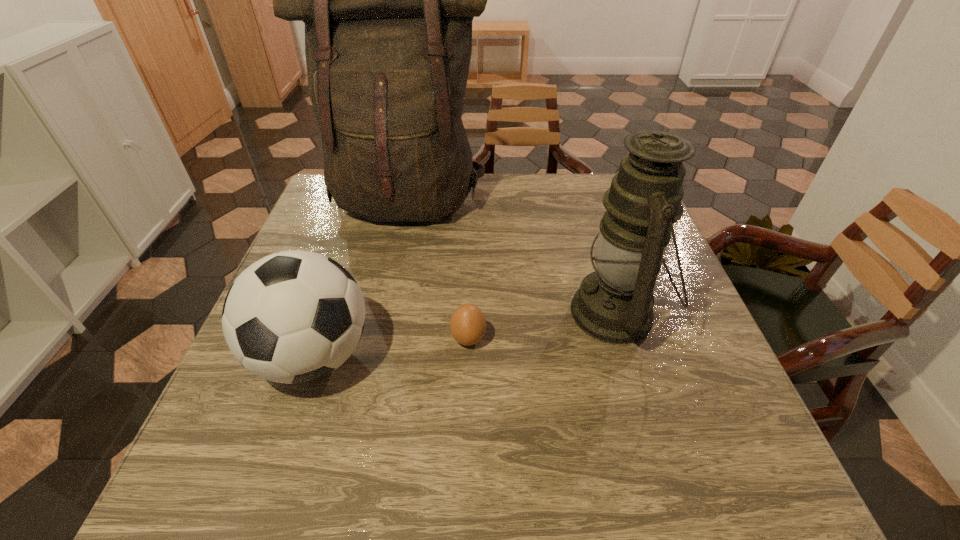
Where is `the tallest object`? The height and width of the screenshot is (540, 960). the tallest object is located at coordinates (388, 0).

The image size is (960, 540). What are the coordinates of `backpack` in the screenshot? It's located at (388, 0).

The width and height of the screenshot is (960, 540). What are the coordinates of `the third shortest object` in the screenshot? It's located at (614, 304).

Where is `the rightmost object`? the rightmost object is located at coordinates (614, 304).

This screenshot has width=960, height=540. In order to click on the third tallest object in this screenshot , I will do `click(295, 316)`.

Image resolution: width=960 pixels, height=540 pixels. In order to click on boiled egg in this screenshot , I will do [467, 325].

Locate an element on the screen. This screenshot has width=960, height=540. vacant space located 0.220m on the open flap of the farthest object is located at coordinates (386, 296).

The height and width of the screenshot is (540, 960). Identify the location of vacant space located 0.070m on the back of the third shortest object. (598, 253).

This screenshot has height=540, width=960. Identify the location of free spot located on the right of the second shortest object. (564, 356).

What are the coordinates of `vacant space located 0.220m on the back of the shortest object` in the screenshot? It's located at (470, 259).